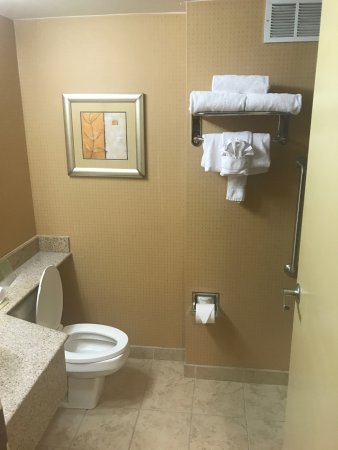
The height and width of the screenshot is (450, 338). In order to click on toilet bowl in this screenshot , I will do `click(88, 370)`.